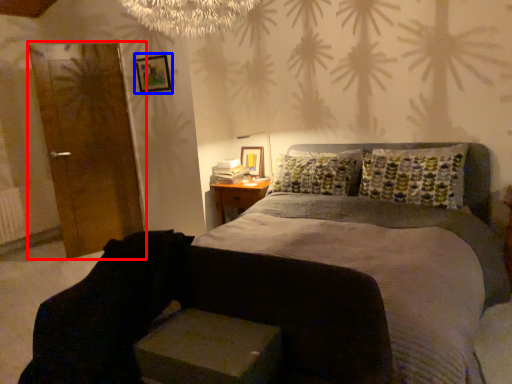
Question: Which object appears closest to the camera in this image, armoire (highlighted by a red box) or picture frame (highlighted by a blue box)?

Choices:
 (A) armoire
 (B) picture frame

Answer: (A)